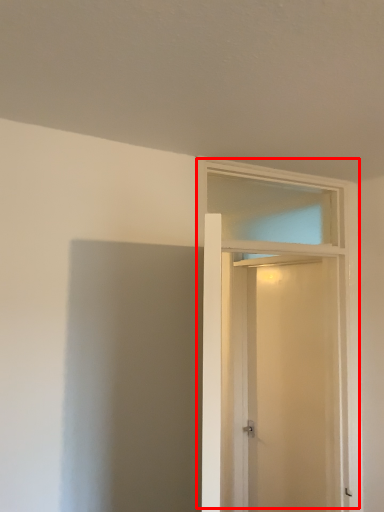
Question: From the image's perspective, what is the correct spatial relationship of door (annotated by the red box) in relation to screen door?

Choices:
 (A) below
 (B) above

Answer: (B)